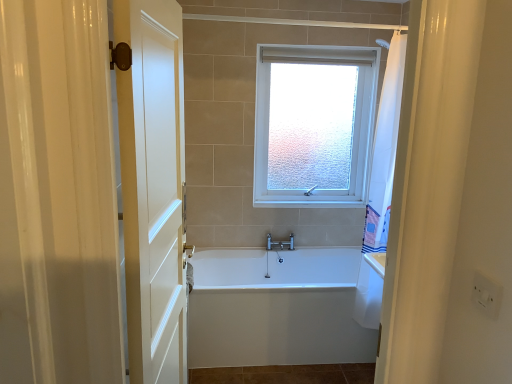
What do you see at coordinates (153, 187) in the screenshot? I see `white wooden door at left` at bounding box center [153, 187].

Identify the location of white glossy bathtub at center. (276, 309).

Based on the photo, from the image's perspective, is frosted glass window at upper center above or below white glossy bathtub at center?

frosted glass window at upper center is above white glossy bathtub at center.

Which is less distant, (335, 70) or (227, 314)?

Clearly, point (335, 70) is more distant from the camera than point (227, 314).

Is frosted glass window at upper center oriented away from white glossy bathtub at center?

That's not correct — frosted glass window at upper center is not looking away from white glossy bathtub at center.

Find the location of a particular element. window behind the white glossy bathtub at center is located at coordinates (314, 125).

Is white wooden door at left turned away from frosted glass window at upper center?

That's not correct — white wooden door at left is not looking away from frosted glass window at upper center.

Which object is more forward, white wooden door at left or frosted glass window at upper center?

white wooden door at left is more forward.

Is frosted glass window at upper center completely or partially inside white wooden door at left?

That's incorrect, frosted glass window at upper center is not inside white wooden door at left.

From a real-world perspective, is white glossy bathtub at center on top of white wooden door at left?

No.

Based on the photo, between white glossy bathtub at center and white wooden door at left, which one has smaller size?

white wooden door at left is smaller.

Is white wooden door at left at the back of white glossy bathtub at center?

No, white glossy bathtub at center's orientation is not away from white wooden door at left.

Can you confirm if white glossy bathtub at center is taller than white wooden door at left?

No.

How much distance is there between white glossy bathtub at center and frosted glass window at upper center?

white glossy bathtub at center is 3.93 feet from frosted glass window at upper center.

From a real-world perspective, which is physically below, white glossy bathtub at center or frosted glass window at upper center?

white glossy bathtub at center.

I want to click on bathtub below the frosted glass window at upper center (from the image's perspective), so click(276, 309).

In the scene shown: In terms of size, does white glossy bathtub at center appear bigger or smaller than frosted glass window at upper center?

In the image, white glossy bathtub at center appears to be larger than frosted glass window at upper center.

Between white wooden door at left and white glossy bathtub at center, which one has smaller size?

white wooden door at left.

Is white glossy bathtub at center inside white wooden door at left?

No.

Is white wooden door at left next to white glossy bathtub at center?

white wooden door at left and white glossy bathtub at center are clearly separated.

Based on the photo, in terms of height, does frosted glass window at upper center look taller or shorter compared to white wooden door at left?

In the image, frosted glass window at upper center appears to be shorter than white wooden door at left.

From the image's perspective, does frosted glass window at upper center appear lower than white wooden door at left?

No, from the image's perspective, frosted glass window at upper center is not below white wooden door at left.

How much distance is there between frosted glass window at upper center and white wooden door at left?

frosted glass window at upper center and white wooden door at left are 1.67 meters apart from each other.

What's the angular difference between frosted glass window at upper center and white wooden door at left's facing directions?

The facing directions of frosted glass window at upper center and white wooden door at left are 83.8 degrees apart.

Find the location of a particular element. The width and height of the screenshot is (512, 384). bathtub in front of the frosted glass window at upper center is located at coordinates (276, 309).

The height and width of the screenshot is (384, 512). In order to click on window behind the white wooden door at left in this screenshot , I will do click(314, 125).

Consider the image. When comparing their distances from frosted glass window at upper center, does white wooden door at left or white glossy bathtub at center seem closer?

white glossy bathtub at center lies closer to frosted glass window at upper center than the other object.

When comparing their distances from white glossy bathtub at center, does frosted glass window at upper center or white wooden door at left seem further?

frosted glass window at upper center is further to white glossy bathtub at center.

Considering their positions, is white glossy bathtub at center positioned further to frosted glass window at upper center than white wooden door at left?

white wooden door at left is positioned further to the anchor frosted glass window at upper center.

Which object lies nearer to the anchor point white wooden door at left, white glossy bathtub at center or frosted glass window at upper center?

Based on the image, white glossy bathtub at center appears to be nearer to white wooden door at left.

Looking at the image, which one is located closer to white glossy bathtub at center, white wooden door at left or frosted glass window at upper center?

white wooden door at left is closer to white glossy bathtub at center.

When comparing their distances from white wooden door at left, does frosted glass window at upper center or white glossy bathtub at center seem further?

frosted glass window at upper center lies further to white wooden door at left than the other object.

Locate an element on the screen. This screenshot has height=384, width=512. bathtub between white wooden door at left and frosted glass window at upper center from front to back is located at coordinates (276, 309).